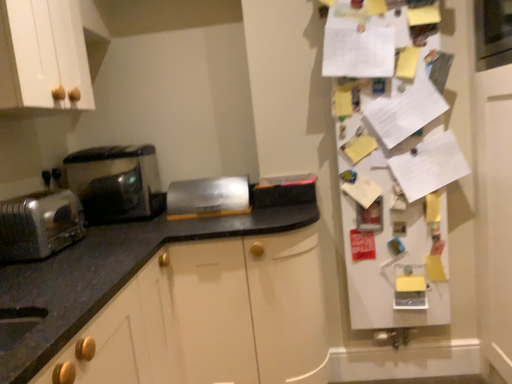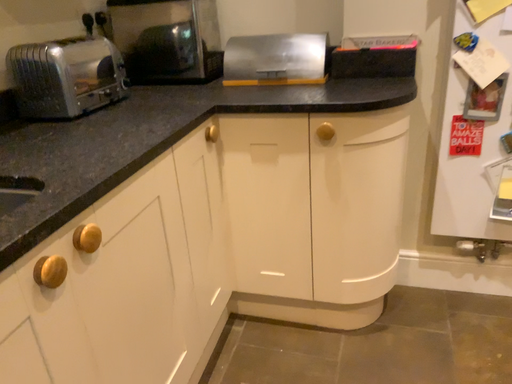
Question: How did the camera likely rotate when shooting the video?

Choices:
 (A) rotated left
 (B) rotated right

Answer: (A)